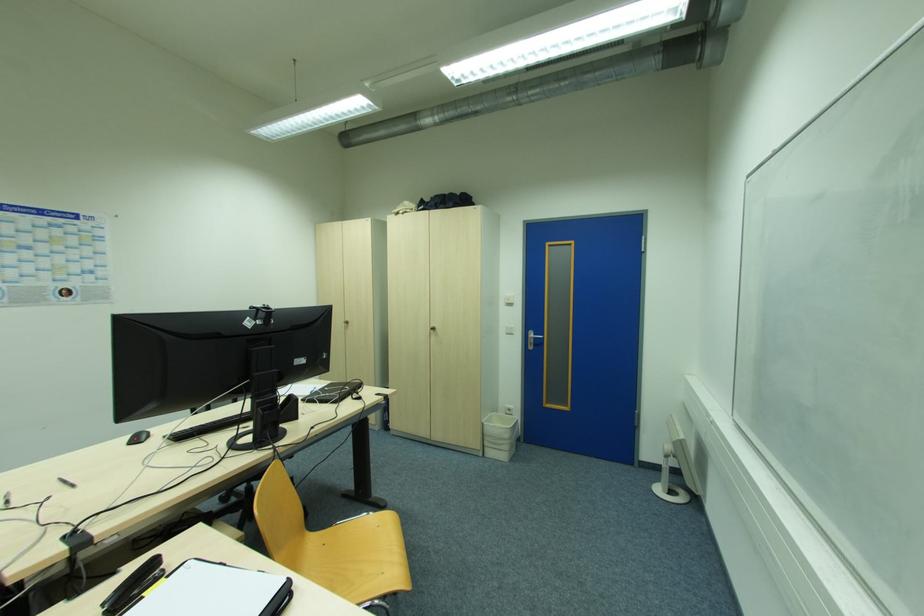
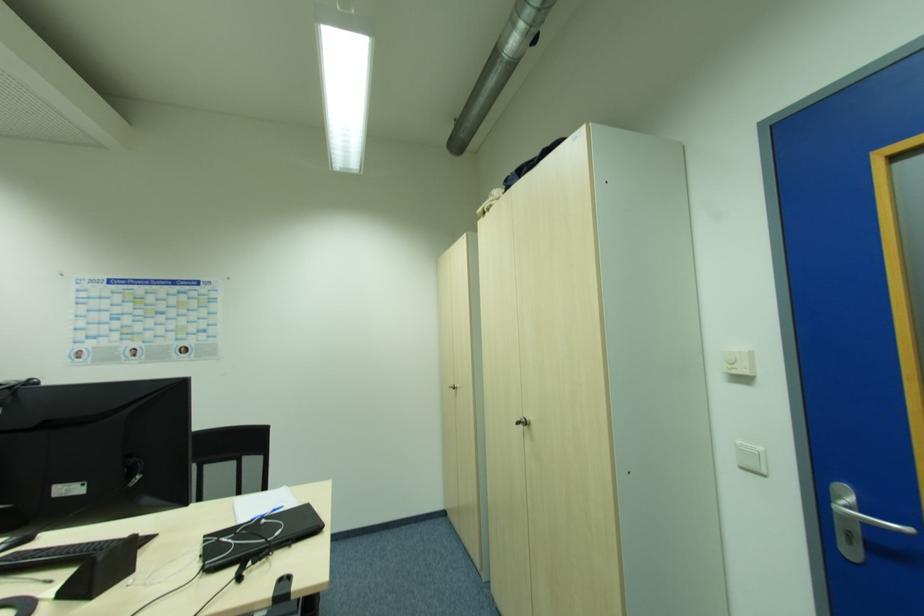
Find the pixel in the second image that matches (329,390) in the first image.

(265, 521)